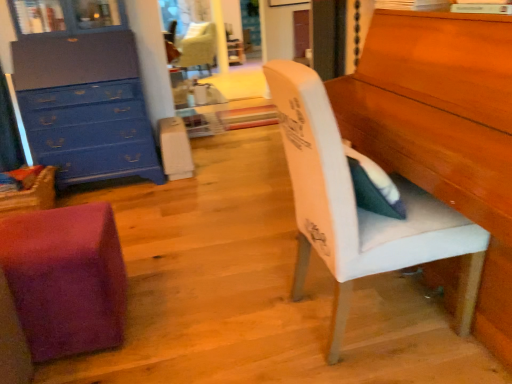
Measure the distance between point (x=198, y=44) and camera.

Point (x=198, y=44) is 16.02 feet away from camera.

In order to click on velvet cream chair at upper center, the third chair positioned from the front in this screenshot , I will do `click(198, 47)`.

From the image's perspective, is blue painted wood chest of drawers at upper left beneath white fabric chair at right, placed as the 1th chair when sorted from right to left?

No, from the image's perspective, blue painted wood chest of drawers at upper left is not beneath white fabric chair at right, placed as the 1th chair when sorted from right to left.

Is the surface of blue painted wood chest of drawers at upper left in direct contact with white fabric chair at right, placed as the 1th chair when sorted from right to left?

No, blue painted wood chest of drawers at upper left is not next to white fabric chair at right, placed as the 1th chair when sorted from right to left.

Is white fabric chair at right, placed as the 1th chair when sorted from right to left, at the back of blue painted wood chest of drawers at upper left?

That's not correct — blue painted wood chest of drawers at upper left is not looking away from white fabric chair at right, placed as the 1th chair when sorted from right to left.

Who is bigger, blue painted wood chest of drawers at upper left or white fabric chair at right, positioned as the first chair in front-to-back order?

blue painted wood chest of drawers at upper left is bigger.

From the image's perspective, is white fabric chair at right, placed as the 1th chair when sorted from right to left, below velvet cream chair at upper center, the third chair positioned from the front?

Indeed, from the image's perspective, white fabric chair at right, placed as the 1th chair when sorted from right to left, is shown beneath velvet cream chair at upper center, the third chair positioned from the front.

Is white fabric chair at right, which is the third chair from back to front, aimed at velvet cream chair at upper center, arranged as the 3th chair when viewed from the right?

No, white fabric chair at right, which is the third chair from back to front, is not oriented towards velvet cream chair at upper center, arranged as the 3th chair when viewed from the right.

Considering the points (280, 89) and (198, 27), which point is behind, point (280, 89) or point (198, 27)?

The point (198, 27) is farther.

Which of these two, white fabric chair at right, the second chair positioned from the bottom, or velvet cream chair at upper center, the third chair positioned from the front, is bigger?

With larger size is velvet cream chair at upper center, the third chair positioned from the front.

Would you say purple fuzzy cube at lower left, which is the 3th chair from top to bottom, is a long distance from white fabric chair at right, positioned as the first chair in front-to-back order?

Actually, purple fuzzy cube at lower left, which is the 3th chair from top to bottom, and white fabric chair at right, positioned as the first chair in front-to-back order, are a little close together.

Considering the relative positions of purple fuzzy cube at lower left, which is counted as the second chair, starting from the right, and white fabric chair at right, placed as the 1th chair when sorted from right to left, in the image provided, is purple fuzzy cube at lower left, which is counted as the second chair, starting from the right, behind white fabric chair at right, placed as the 1th chair when sorted from right to left,?

Yes, purple fuzzy cube at lower left, which is counted as the second chair, starting from the right, is behind white fabric chair at right, placed as the 1th chair when sorted from right to left.

Which point is more forward, (118, 337) or (338, 333)?

The point (338, 333) is closer.

From a real-world perspective, starting from the white fabric chair at right, positioned as the first chair in front-to-back order, which chair is the 2nd one below it? Please provide its 2D coordinates.

[(66, 279)]

From the image's perspective, which is below, velvet cream chair at upper center, the third chair positioned from the front, or blue painted wood chest of drawers at upper left?

From the image's view, blue painted wood chest of drawers at upper left is below.

Does velvet cream chair at upper center, which is the first chair in left-to-right order, have a smaller size compared to blue painted wood chest of drawers at upper left?

Incorrect, velvet cream chair at upper center, which is the first chair in left-to-right order, is not smaller in size than blue painted wood chest of drawers at upper left.

Is velvet cream chair at upper center, which is the first chair in left-to-right order, turned away from blue painted wood chest of drawers at upper left?

That's not correct — velvet cream chair at upper center, which is the first chair in left-to-right order, is not looking away from blue painted wood chest of drawers at upper left.

Is point (194, 52) closer or farther from the camera than point (92, 176)?

Point (194, 52) is farther from the camera than point (92, 176).

Considering the sizes of blue painted wood chest of drawers at upper left and purple fuzzy cube at lower left, which is counted as the second chair, starting from the right, in the image, is blue painted wood chest of drawers at upper left taller or shorter than purple fuzzy cube at lower left, which is counted as the second chair, starting from the right,?

Considering their sizes, blue painted wood chest of drawers at upper left has more height than purple fuzzy cube at lower left, which is counted as the second chair, starting from the right.

Is blue painted wood chest of drawers at upper left to the left of purple fuzzy cube at lower left, which is counted as the second chair, starting from the right, from the viewer's perspective?

Yes.

How many degrees apart are the facing directions of blue painted wood chest of drawers at upper left and purple fuzzy cube at lower left, the 2th chair when ordered from left to right?

There is a 93.4-degree angle between the facing directions of blue painted wood chest of drawers at upper left and purple fuzzy cube at lower left, the 2th chair when ordered from left to right.

From the image's perspective, between velvet cream chair at upper center, the third chair from the bottom, and purple fuzzy cube at lower left, placed as the second chair when sorted from back to front, who is located below?

purple fuzzy cube at lower left, placed as the second chair when sorted from back to front, from the image's perspective.

Is velvet cream chair at upper center, arranged as the 3th chair when viewed from the right, further to the viewer compared to purple fuzzy cube at lower left, which is counted as the second chair, starting from the right?

Yes, the depth of velvet cream chair at upper center, arranged as the 3th chair when viewed from the right, is greater than that of purple fuzzy cube at lower left, which is counted as the second chair, starting from the right.

From the velvet cream chair at upper center, the third chair from the bottom, count 1st chairs forward and point to it. Please provide its 2D coordinates.

[(66, 279)]

Are velvet cream chair at upper center, the third chair from the bottom, and purple fuzzy cube at lower left, which is counted as the second chair, starting from the right, making contact?

No, velvet cream chair at upper center, the third chair from the bottom, is not making contact with purple fuzzy cube at lower left, which is counted as the second chair, starting from the right.

Considering the sizes of objects velvet cream chair at upper center, the third chair positioned from the front, and white fabric chair at right, positioned as the first chair in front-to-back order, in the image provided, who is thinner, velvet cream chair at upper center, the third chair positioned from the front, or white fabric chair at right, positioned as the first chair in front-to-back order,?

white fabric chair at right, positioned as the first chair in front-to-back order, is thinner.

Between velvet cream chair at upper center, the first chair from the top, and white fabric chair at right, the second chair positioned from the bottom, which one has less height?

Standing shorter between the two is velvet cream chair at upper center, the first chair from the top.

Considering the positions of points (200, 47) and (340, 316), is point (200, 47) closer to camera compared to point (340, 316)?

No.

Is velvet cream chair at upper center, which is the first chair in left-to-right order, facing away from white fabric chair at right, which is the third chair from back to front?

No, velvet cream chair at upper center, which is the first chair in left-to-right order, is not facing away from white fabric chair at right, which is the third chair from back to front.

This screenshot has height=384, width=512. I want to click on the 1st chair below the blue painted wood chest of drawers at upper left (from a real-world perspective), so click(x=359, y=208).

You are a GUI agent. You are given a task and a screenshot of the screen. Output one action in this format:
    pyautogui.click(x=<x>, y=<y>)
    Task: Click on the 2nd chair counting from the left of the white fabric chair at right, which is the third chair from back to front
    This screenshot has height=384, width=512.
    Given the screenshot: What is the action you would take?
    pyautogui.click(x=198, y=47)

Considering their positions, is purple fuzzy cube at lower left, arranged as the second chair when viewed from the front, positioned closer to blue painted wood chest of drawers at upper left than velvet cream chair at upper center, which is the first chair from back to front?

Answer: purple fuzzy cube at lower left, arranged as the second chair when viewed from the front, is closer to blue painted wood chest of drawers at upper left.

When comparing their distances from velvet cream chair at upper center, which is the first chair in left-to-right order, does white fabric chair at right, which is the third chair from back to front, or purple fuzzy cube at lower left, the 2th chair when ordered from left to right, seem closer?

purple fuzzy cube at lower left, the 2th chair when ordered from left to right, lies closer to velvet cream chair at upper center, which is the first chair in left-to-right order, than the other object.

Based on their spatial positions, is velvet cream chair at upper center, which is the first chair in left-to-right order, or white fabric chair at right, which is counted as the 3th chair, starting from the left, closer to purple fuzzy cube at lower left, placed as the second chair when sorted from back to front?

The object closer to purple fuzzy cube at lower left, placed as the second chair when sorted from back to front, is white fabric chair at right, which is counted as the 3th chair, starting from the left.

Estimate the real-world distances between objects in this image. Which object is further from velvet cream chair at upper center, which is the first chair in left-to-right order, white fabric chair at right, arranged as the second chair when viewed from the top, or blue painted wood chest of drawers at upper left?

Based on the image, white fabric chair at right, arranged as the second chair when viewed from the top, appears to be further to velvet cream chair at upper center, which is the first chair in left-to-right order.

Based on their spatial positions, is purple fuzzy cube at lower left, which ranks as the first chair in bottom-to-top order, or white fabric chair at right, which is the third chair from back to front, further from velvet cream chair at upper center, the third chair positioned from the front?

white fabric chair at right, which is the third chair from back to front, lies further to velvet cream chair at upper center, the third chair positioned from the front, than the other object.

When comparing their distances from purple fuzzy cube at lower left, which is the 3th chair from top to bottom, does white fabric chair at right, which is counted as the 3th chair, starting from the left, or velvet cream chair at upper center, arranged as the 3th chair when viewed from the right, seem closer?

white fabric chair at right, which is counted as the 3th chair, starting from the left, is closer to purple fuzzy cube at lower left, which is the 3th chair from top to bottom.

Based on their spatial positions, is purple fuzzy cube at lower left, which ranks as the first chair in bottom-to-top order, or blue painted wood chest of drawers at upper left further from velvet cream chair at upper center, which is the first chair from back to front?

purple fuzzy cube at lower left, which ranks as the first chair in bottom-to-top order, is further to velvet cream chair at upper center, which is the first chair from back to front.

Looking at the image, which one is located closer to blue painted wood chest of drawers at upper left, purple fuzzy cube at lower left, the 2th chair when ordered from left to right, or white fabric chair at right, the second chair positioned from the bottom?

The object closer to blue painted wood chest of drawers at upper left is purple fuzzy cube at lower left, the 2th chair when ordered from left to right.

Identify the location of the chest of drawers located between purple fuzzy cube at lower left, arranged as the second chair when viewed from the front, and velvet cream chair at upper center, the third chair from the bottom, in the depth direction. (88, 99).

Where is `chair between white fabric chair at right, which is the third chair from back to front, and velvet cream chair at upper center, which is the first chair from back to front, along the z-axis`? chair between white fabric chair at right, which is the third chair from back to front, and velvet cream chair at upper center, which is the first chair from back to front, along the z-axis is located at coordinates (66, 279).

Locate an element on the screen. chest of drawers between white fabric chair at right, which is the third chair from back to front, and velvet cream chair at upper center, which is the first chair from back to front, in the front-back direction is located at coordinates (88, 99).